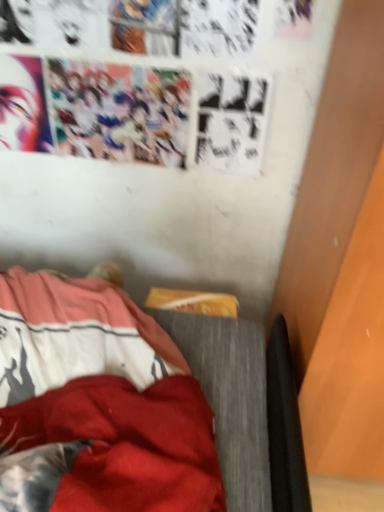
Where is `wooden bed frame at lower left`? Image resolution: width=384 pixels, height=512 pixels. wooden bed frame at lower left is located at coordinates (97, 404).

The height and width of the screenshot is (512, 384). What do you see at coordinates (97, 404) in the screenshot? I see `wooden bed frame at lower left` at bounding box center [97, 404].

Image resolution: width=384 pixels, height=512 pixels. What are the coordinates of `smooth matte face at upper left` in the screenshot? It's located at (18, 106).

Describe the element at coordinates (18, 106) in the screenshot. The image size is (384, 512). I see `smooth matte face at upper left` at that location.

This screenshot has height=512, width=384. I want to click on wooden bed frame at lower left, so click(x=97, y=404).

Considering the relative positions of wooden bed frame at lower left and smooth matte face at upper left in the image provided, is wooden bed frame at lower left to the right of smooth matte face at upper left from the viewer's perspective?

Correct, you'll find wooden bed frame at lower left to the right of smooth matte face at upper left.

Relative to smooth matte face at upper left, is wooden bed frame at lower left in front or behind?

In the image, wooden bed frame at lower left appears in front of smooth matte face at upper left.

Considering the points (91, 387) and (33, 136), which point is behind, point (91, 387) or point (33, 136)?

The point (33, 136) is behind.

From the image's perspective, is wooden bed frame at lower left above or below smooth matte face at upper left?

From the image's perspective, wooden bed frame at lower left appears below smooth matte face at upper left.

From a real-world perspective, which object rests below the other?

In real-world perspective, wooden bed frame at lower left is lower.

Does wooden bed frame at lower left have a greater width compared to smooth matte face at upper left?

Yes, wooden bed frame at lower left is wider than smooth matte face at upper left.

Considering the relative sizes of wooden bed frame at lower left and smooth matte face at upper left in the image provided, is wooden bed frame at lower left taller than smooth matte face at upper left?

In fact, wooden bed frame at lower left may be shorter than smooth matte face at upper left.

Between wooden bed frame at lower left and smooth matte face at upper left, which one has smaller size?

smooth matte face at upper left.

Can smooth matte face at upper left be found inside wooden bed frame at lower left?

That's incorrect, smooth matte face at upper left is not inside wooden bed frame at lower left.

Are wooden bed frame at lower left and smooth matte face at upper left far apart?

→ wooden bed frame at lower left is actually quite close to smooth matte face at upper left.

Could you tell me if wooden bed frame at lower left is facing smooth matte face at upper left?

No, wooden bed frame at lower left does not turn towards smooth matte face at upper left.

Can you tell me how much wooden bed frame at lower left and smooth matte face at upper left differ in facing direction?

The angle between the facing direction of wooden bed frame at lower left and the facing direction of smooth matte face at upper left is 94.6 degrees.

You are a GUI agent. You are given a task and a screenshot of the screen. Output one action in this format:
    pyautogui.click(x=<x>, y=<y>)
    Task: Click on the human face above the wooden bed frame at lower left (from the image's perspective)
    This screenshot has width=384, height=512.
    Given the screenshot: What is the action you would take?
    pyautogui.click(x=18, y=106)

Between smooth matte face at upper left and wooden bed frame at lower left, which one appears on the left side from the viewer's perspective?

smooth matte face at upper left.

Does smooth matte face at upper left come behind wooden bed frame at lower left?

Yes, smooth matte face at upper left is further from the camera.

Considering the points (32, 117) and (213, 463), which point is behind, point (32, 117) or point (213, 463)?

The point (32, 117) is more distant.

Consider the image. From the image's perspective, is smooth matte face at upper left above or below wooden bed frame at lower left?

Clearly, from the image's perspective, smooth matte face at upper left is above wooden bed frame at lower left.

From a real-world perspective, between smooth matte face at upper left and wooden bed frame at lower left, who is vertically lower?

wooden bed frame at lower left is physically lower.

Which of these two, smooth matte face at upper left or wooden bed frame at lower left, is thinner?

smooth matte face at upper left.

Considering the sizes of objects smooth matte face at upper left and wooden bed frame at lower left in the image provided, who is taller, smooth matte face at upper left or wooden bed frame at lower left?

smooth matte face at upper left is taller.

Who is bigger, smooth matte face at upper left or wooden bed frame at lower left?

wooden bed frame at lower left.

Is smooth matte face at upper left positioned beyond the bounds of wooden bed frame at lower left?

Yes, smooth matte face at upper left is not within wooden bed frame at lower left.

Are smooth matte face at upper left and wooden bed frame at lower left far apart?

smooth matte face at upper left is actually quite close to wooden bed frame at lower left.

Could you tell me if smooth matte face at upper left is facing wooden bed frame at lower left?

No, smooth matte face at upper left is not facing towards wooden bed frame at lower left.

How many degrees apart are the facing directions of smooth matte face at upper left and wooden bed frame at lower left?

The angular difference between smooth matte face at upper left and wooden bed frame at lower left is 94.6 degrees.

Find the location of `human face behind the wooden bed frame at lower left`. human face behind the wooden bed frame at lower left is located at coordinates (18, 106).

You are a GUI agent. You are given a task and a screenshot of the screen. Output one action in this format:
    pyautogui.click(x=<x>, y=<y>)
    Task: Click on the human face above the wooden bed frame at lower left (from a real-world perspective)
    
    Given the screenshot: What is the action you would take?
    pos(18,106)

The height and width of the screenshot is (512, 384). Identify the location of human face that is on the left side of wooden bed frame at lower left. (18, 106).